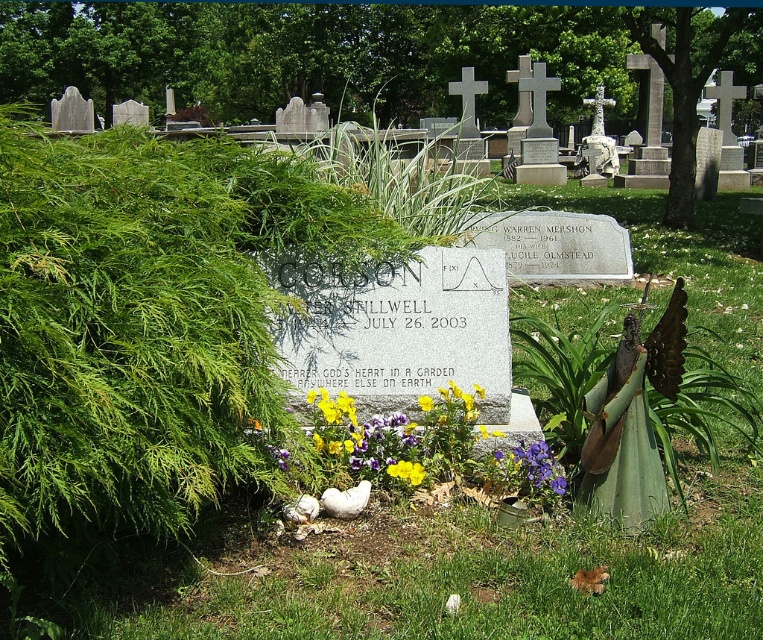
The image size is (763, 640). What do you see at coordinates (147, 323) in the screenshot? I see `green leafy bush at left` at bounding box center [147, 323].

Between green leafy bush at left and purple matte flower at center, which one appears on the left side from the viewer's perspective?

Positioned to the left is green leafy bush at left.

Does point (192, 252) lie in front of point (523, 468)?

That is True.

This screenshot has width=763, height=640. I want to click on green leafy bush at left, so click(x=147, y=323).

Is point (536, 474) positioned before point (420, 406)?

Yes, point (536, 474) is closer to viewer.

Is purple matte flower at center to the left of yellow matte flower at center from the viewer's perspective?

In fact, purple matte flower at center is to the right of yellow matte flower at center.

Is point (551, 484) farther from viewer compared to point (423, 400)?

No, it is in front of (423, 400).

What are the coordinates of `purple matte flower at center` in the screenshot? It's located at (533, 468).

Is white stone cross at center smaller than yellow matte flower at center?

No.

Does white stone cross at center appear over yellow matte flower at center?

Yes, white stone cross at center is above yellow matte flower at center.

Where is `white stone cross at center`? Image resolution: width=763 pixels, height=640 pixels. white stone cross at center is located at coordinates (597, 140).